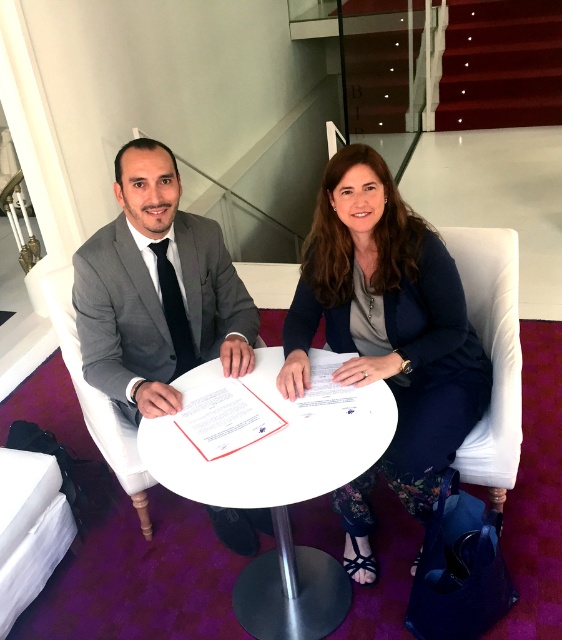
Question: Among these points, which one is farthest from the camera?

Choices:
 (A) (129, 372)
 (B) (121, 289)

Answer: (B)

Question: Can you confirm if matte navy blazer at center is positioned above matte gray suit at center?

Choices:
 (A) yes
 (B) no

Answer: (B)

Question: Observing the image, what is the correct spatial positioning of white glossy table at center in reference to matte gray suit at center?

Choices:
 (A) above
 (B) below

Answer: (B)

Question: Among these objects, which one is farthest from the camera?

Choices:
 (A) gray suit at center
 (B) matte navy blazer at center
 (C) white glossy table at center

Answer: (B)

Question: Observing the image, what is the correct spatial positioning of white glossy table at center in reference to matte gray suit at center?

Choices:
 (A) below
 (B) above

Answer: (A)

Question: Estimate the real-world distances between objects in this image. Which object is closer to the matte navy blazer at center?

Choices:
 (A) white glossy table at center
 (B) gray suit at center
 (C) matte gray suit at center

Answer: (A)